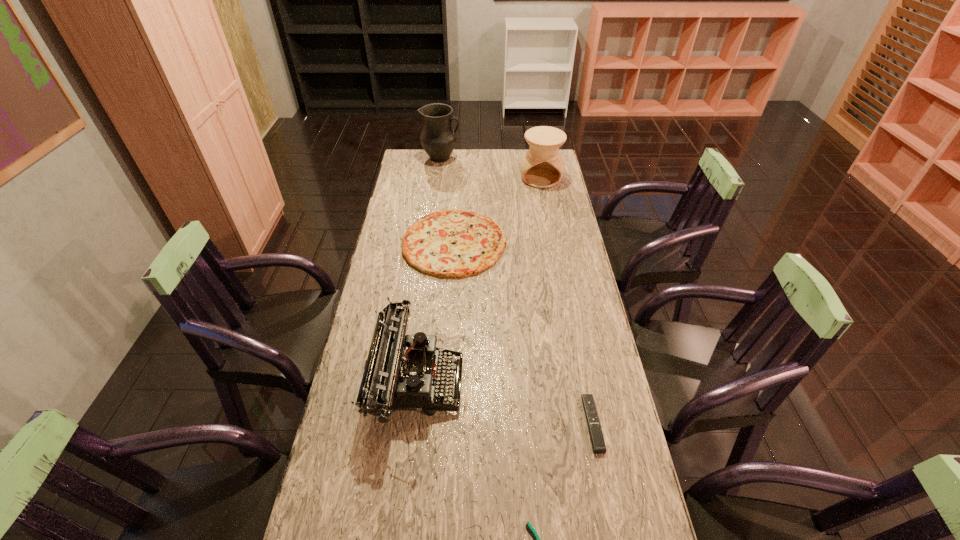
This screenshot has width=960, height=540. What are the coordinates of `vacant space that satisfies the following two spatial constraints: 1. at the open side of the second shortest object; 2. on the right side of the second farthest object` in the screenshot? It's located at (587, 423).

Identify the location of free spot that satisfies the following two spatial constraints: 1. on the keyboard of the fourth shortest object; 2. on the back side of the remote control. The height and width of the screenshot is (540, 960). (411, 423).

The width and height of the screenshot is (960, 540). I want to click on free spot that satisfies the following two spatial constraints: 1. on the keyboard of the fourth shortest object; 2. on the back side of the second shortest object, so click(x=411, y=423).

The width and height of the screenshot is (960, 540). Identify the location of vacant point that satisfies the following two spatial constraints: 1. on the handle side of the third farthest object; 2. on the right side of the farthest object. (430, 243).